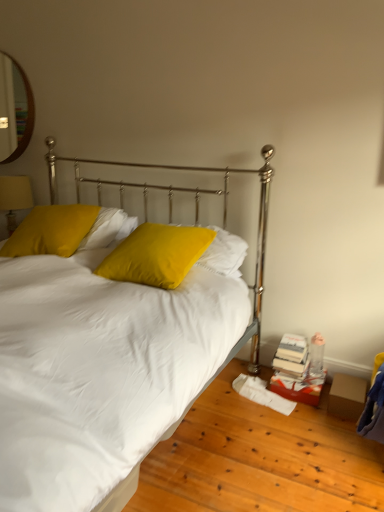
Question: Would you say matte yellow pillow at upper left, the second pillow in the right-to-left sequence, is inside or outside matte yellow fabric at left?

Choices:
 (A) inside
 (B) outside

Answer: (B)

Question: In terms of size, does matte yellow pillow at upper left, positioned as the 1th pillow in left-to-right order, appear bigger or smaller than matte yellow fabric at left?

Choices:
 (A) small
 (B) big

Answer: (B)

Question: Estimate the real-world distances between objects in this image. Which object is closer to the matte yellow fabric at left?

Choices:
 (A) wooden framed mirror at upper left
 (B) white satin bed at center
 (C) matte yellow pillow at upper left, the second pillow in the right-to-left sequence
 (D) matte yellow pillow at center, which is the 2th pillow in left-to-right order

Answer: (B)

Question: Which of these objects is positioned closest to the matte yellow pillow at upper left, positioned as the 1th pillow in left-to-right order?

Choices:
 (A) wooden framed mirror at upper left
 (B) matte yellow fabric at left
 (C) matte yellow pillow at center, which is the 2th pillow in left-to-right order
 (D) white satin bed at center

Answer: (C)